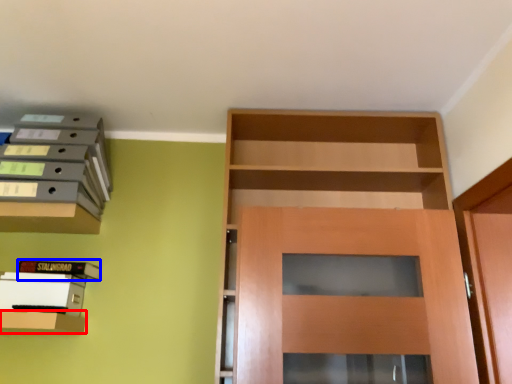
Question: Which point is closer to the camera, shelf (highlighted by a red box) or book (highlighted by a blue box)?

Choices:
 (A) shelf
 (B) book

Answer: (A)